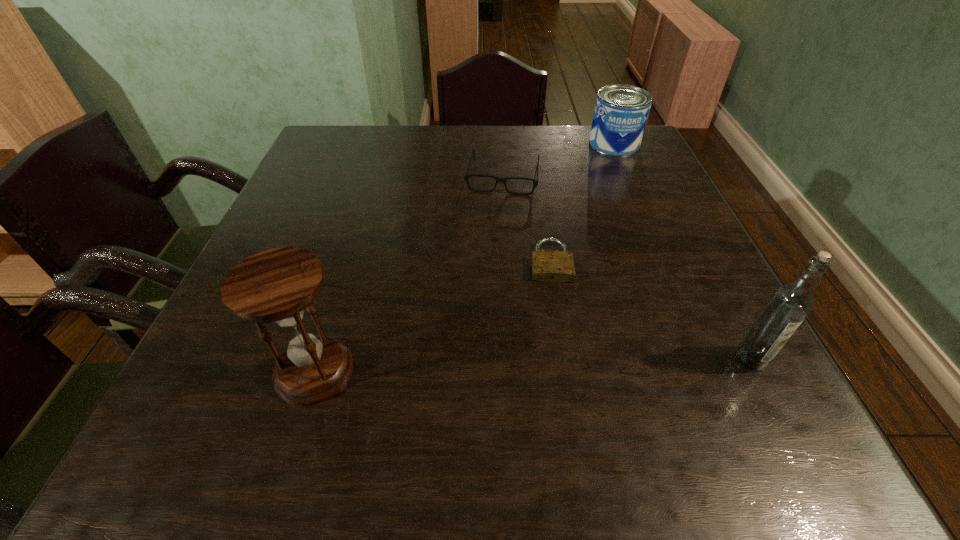
Find the location of a particular element. vacant space at the left edge is located at coordinates (227, 354).

Find the location of a particular element. This screenshot has width=960, height=540. vacant space at the right edge of the desktop is located at coordinates (736, 320).

Locate an element on the screen. Image resolution: width=960 pixels, height=540 pixels. vacant space at the far left corner of the desktop is located at coordinates (363, 134).

Locate an element on the screen. The height and width of the screenshot is (540, 960). vacant space at the near right corner of the desktop is located at coordinates (x=775, y=399).

You are a GUI agent. You are given a task and a screenshot of the screen. Output one action in this format:
    pyautogui.click(x=<x>, y=<y>)
    Task: Click on the vacant space that is in between the hourglass and the farthest object
    
    Given the screenshot: What is the action you would take?
    pyautogui.click(x=465, y=257)

The height and width of the screenshot is (540, 960). I want to click on vacant space that is in between the can and the fourth tallest object, so click(x=559, y=159).

This screenshot has width=960, height=540. Find the location of `blank region between the second farthest object and the third farthest object`. blank region between the second farthest object and the third farthest object is located at coordinates click(x=527, y=219).

In order to click on free space between the vodka and the padlock in this screenshot , I will do `click(651, 310)`.

Image resolution: width=960 pixels, height=540 pixels. I want to click on empty space between the padlock and the third shortest object, so click(583, 202).

The image size is (960, 540). I want to click on vacant region between the farthest object and the padlock, so click(583, 202).